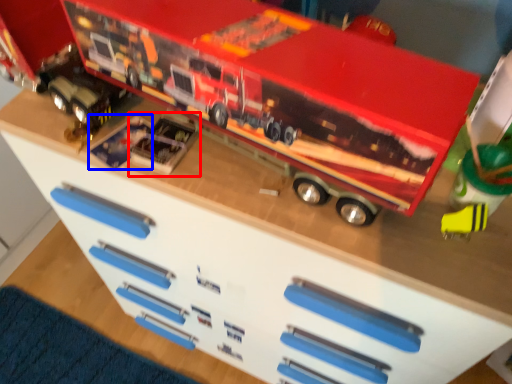
Question: Which point is further to the camera, toy (highlighted by a red box) or toy (highlighted by a blue box)?

Choices:
 (A) toy
 (B) toy

Answer: (B)